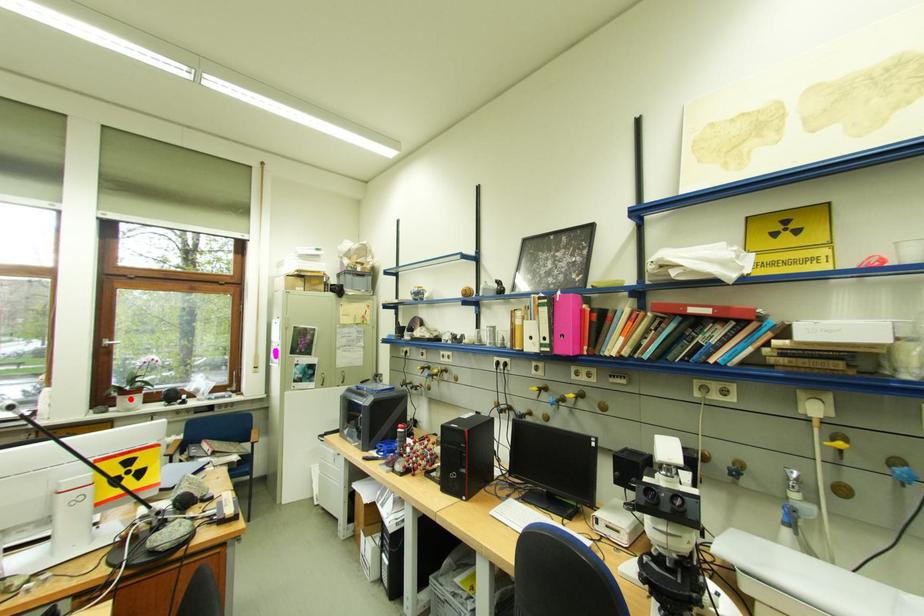
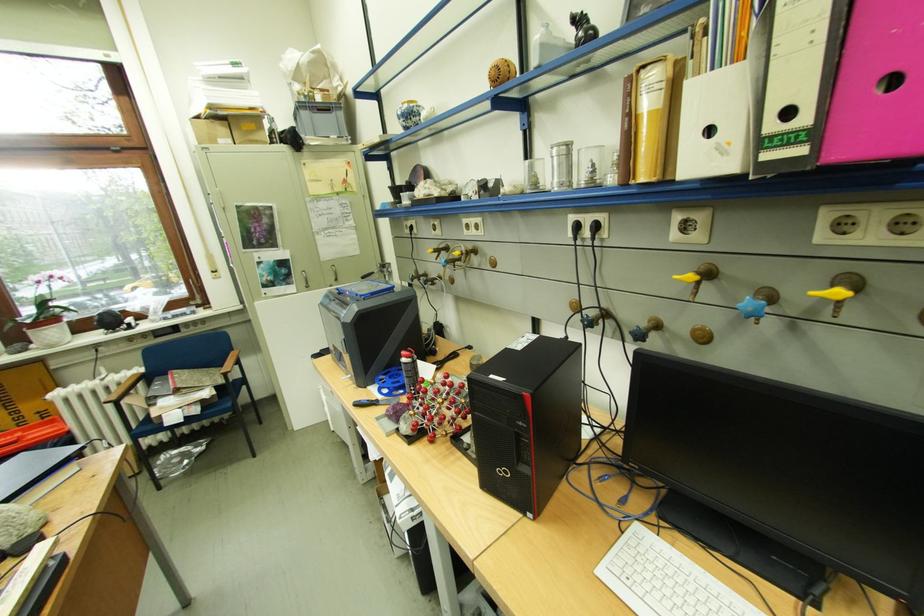
The point at the highlighted location is marked in the first image. Where is the corresponding point in the second image?

(41, 334)